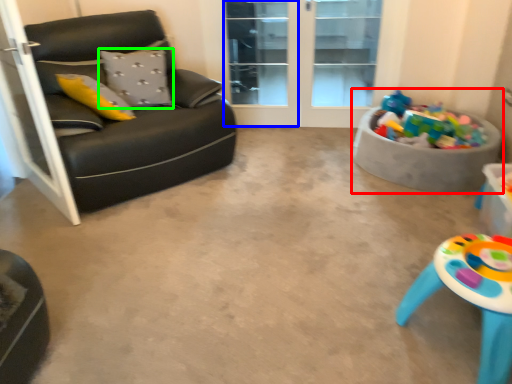
Question: Which is farther away from toy (highlighted by a red box)? screen door (highlighted by a blue box) or pillow (highlighted by a green box)?

Choices:
 (A) screen door
 (B) pillow

Answer: (B)